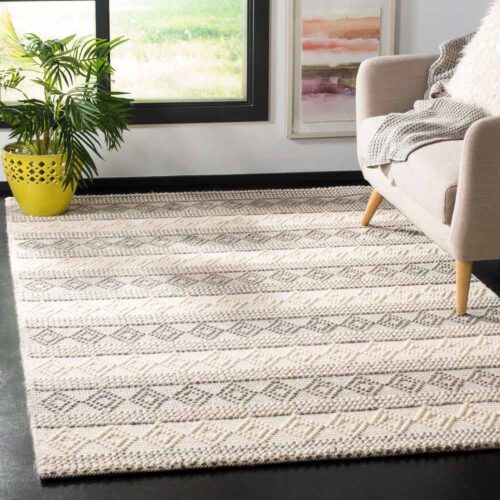
Locate an element on the screen. The image size is (500, 500). space between window and painting is located at coordinates (279, 39).